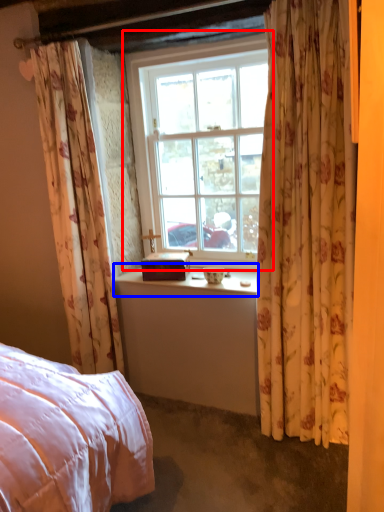
Question: Which point is further to the camera, window (highlighted by a red box) or window sill (highlighted by a blue box)?

Choices:
 (A) window
 (B) window sill

Answer: (B)